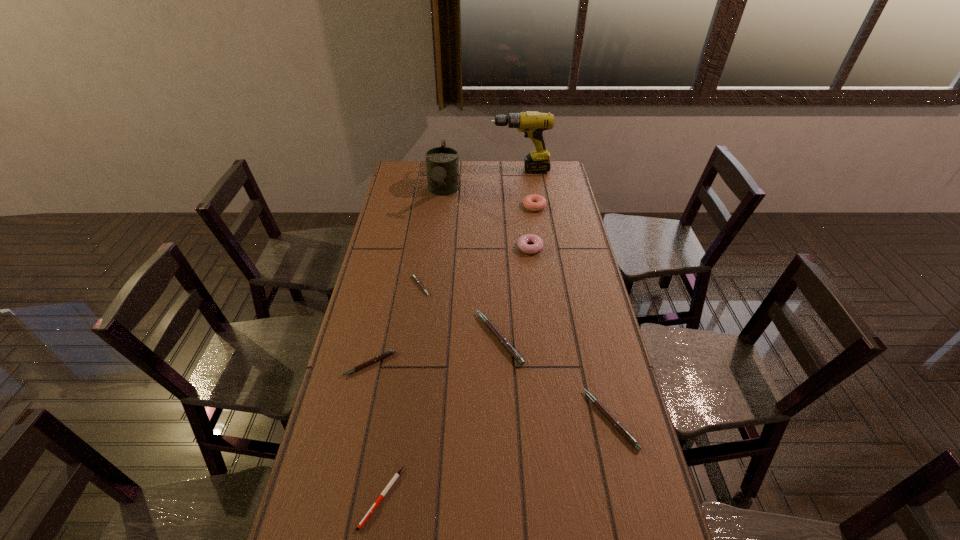
Where is `the second smallest pink pen`? Image resolution: width=960 pixels, height=540 pixels. the second smallest pink pen is located at coordinates [x=381, y=356].

Where is `the third shortest pen`? the third shortest pen is located at coordinates tap(381, 356).

Find the location of `the farthest pen`. the farthest pen is located at coordinates (416, 279).

Identify the location of the smallest pink pen. (416, 279).

Find the location of a particular element. This screenshot has width=960, height=540. the nearest pen is located at coordinates (397, 474).

Find the location of a particular element. The image size is (960, 540). the nearest object is located at coordinates tap(397, 474).

The width and height of the screenshot is (960, 540). In order to click on vacant space situated 0.360m on the handle side of the tallest object in this screenshot , I will do `click(420, 170)`.

Where is `vacant space situated on the handle side of the tallest object`? vacant space situated on the handle side of the tallest object is located at coordinates (447, 170).

The image size is (960, 540). I want to click on free location located 0.080m on the handle side of the tallest object, so click(475, 170).

Identify the location of vacant space located with the spout on the green watering can. The width and height of the screenshot is (960, 540). [436, 261].